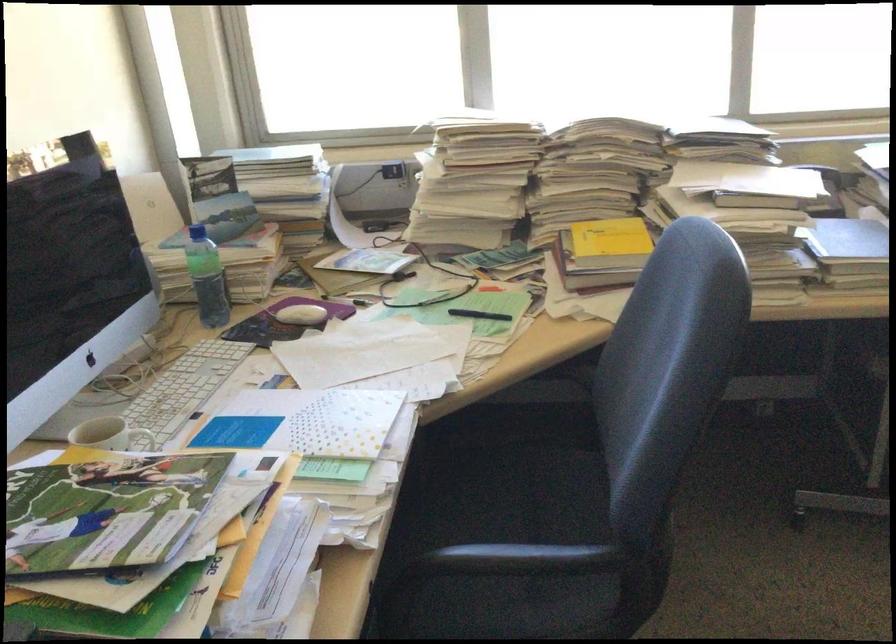
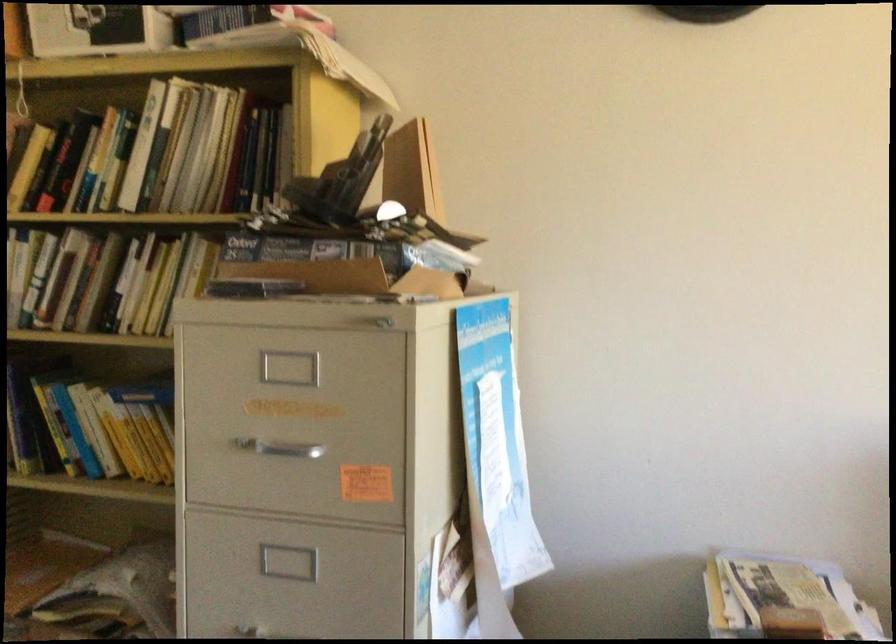
Question: The first image is from the beginning of the video and the second image is from the end. How did the camera likely rotate when shooting the video?

Choices:
 (A) Left
 (B) Right
 (C) Up
 (D) Down

Answer: (A)